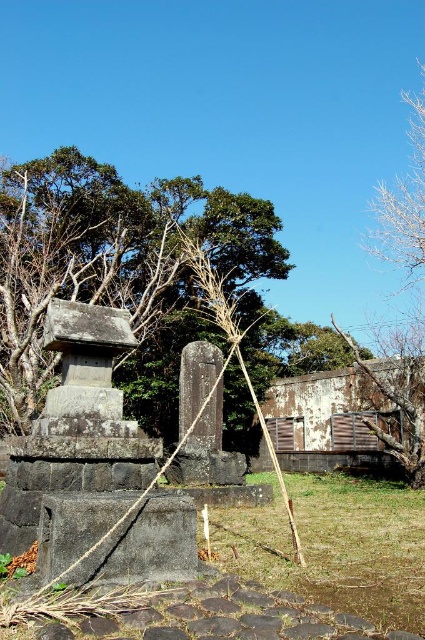
Question: Is rusty corrugated metal hut at center below bare wood tree at right?

Choices:
 (A) no
 (B) yes

Answer: (B)

Question: Does green grass at lower center appear under rusty corrugated metal hut at center?

Choices:
 (A) no
 (B) yes

Answer: (A)

Question: Which point is closer to the camera?

Choices:
 (A) (198, 230)
 (B) (402, 388)

Answer: (B)

Question: Which point appears farthest from the camera in this image?

Choices:
 (A) 422,237
 (B) 39,232
 (C) 280,536
 (D) 405,374

Answer: (B)

Question: Which object is closer to the camera taking this photo?

Choices:
 (A) rusty corrugated metal hut at center
 (B) green grass at lower center
 (C) bare wood tree at right
 (D) green leafy tree at upper center

Answer: (B)

Question: In this image, where is green leafy tree at upper center located relative to green grass at lower center?

Choices:
 (A) below
 (B) above

Answer: (B)